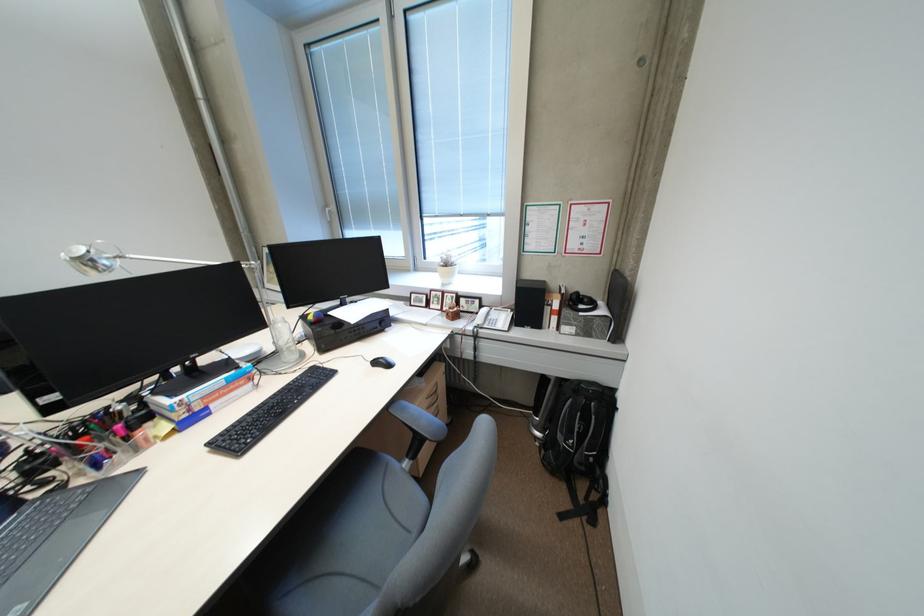
Find where to lift the plastic water bottle. Please return your answer as a coordinate pair (x, y).

(284, 339)